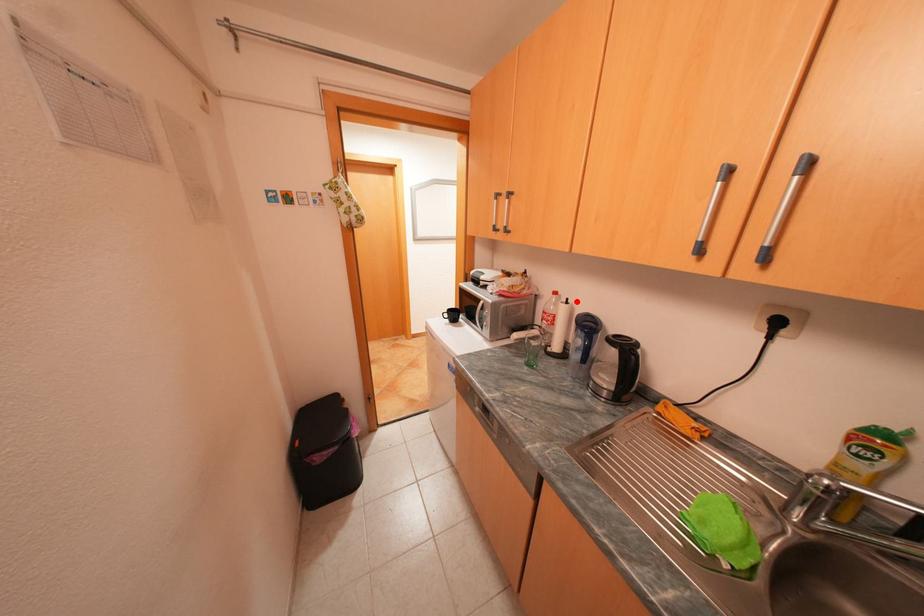
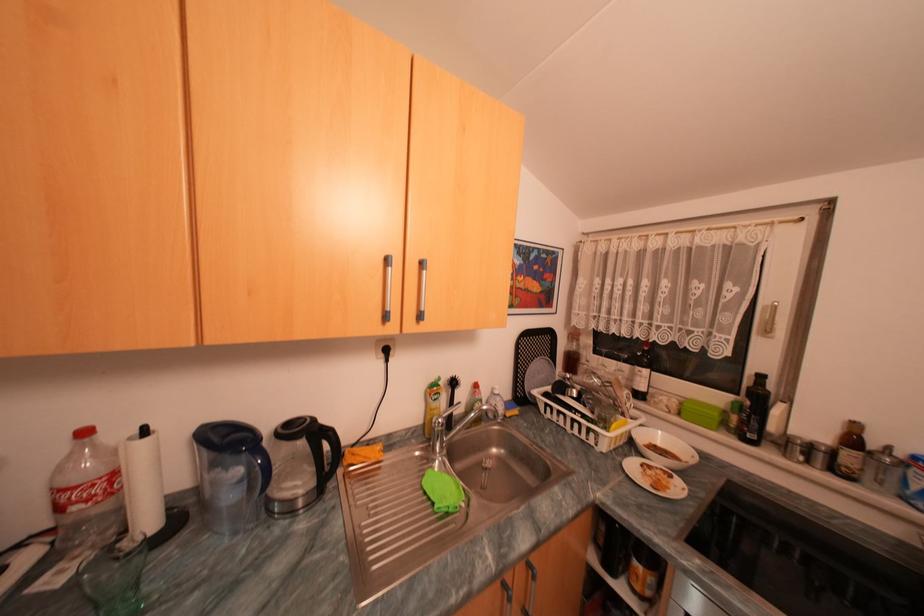
The point at the highlighted location is marked in the first image. Where is the corresponding point in the second image?

(155, 432)